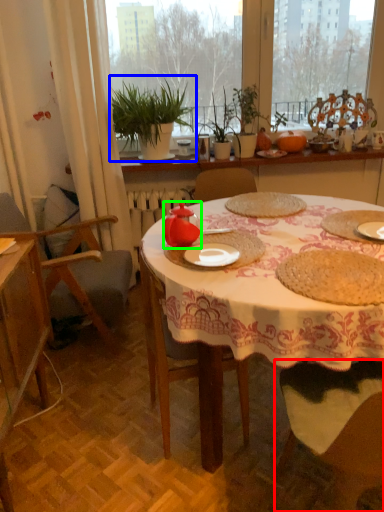
Question: Which object is positioned closest to chair (highlighted by a red box)? Select from houseplant (highlighted by a blue box) and teapot (highlighted by a green box).

Choices:
 (A) houseplant
 (B) teapot

Answer: (B)